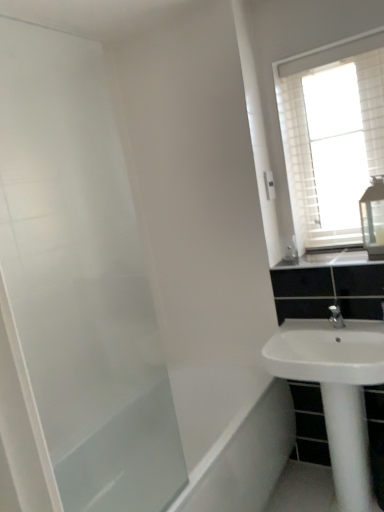
Question: From the image's perspective, is white glossy sink at lower right on top of white textured window at upper right?

Choices:
 (A) yes
 (B) no

Answer: (B)

Question: Considering the relative sizes of white glossy sink at lower right and white textured window at upper right in the image provided, is white glossy sink at lower right taller than white textured window at upper right?

Choices:
 (A) no
 (B) yes

Answer: (A)

Question: Considering the relative positions of white glossy sink at lower right and white textured window at upper right in the image provided, is white glossy sink at lower right to the right of white textured window at upper right from the viewer's perspective?

Choices:
 (A) no
 (B) yes

Answer: (A)

Question: Considering the relative sizes of white glossy sink at lower right and white textured window at upper right in the image provided, is white glossy sink at lower right shorter than white textured window at upper right?

Choices:
 (A) no
 (B) yes

Answer: (B)

Question: Could you tell me if white glossy sink at lower right is facing white textured window at upper right?

Choices:
 (A) no
 (B) yes

Answer: (A)

Question: In terms of width, does white textured window at upper right look wider or thinner when compared to transparent glass screen door at left?

Choices:
 (A) wide
 (B) thin

Answer: (A)

Question: From the image's perspective, relative to transparent glass screen door at left, is white textured window at upper right above or below?

Choices:
 (A) below
 (B) above

Answer: (B)

Question: Choose the correct answer: Is white textured window at upper right inside transparent glass screen door at left or outside it?

Choices:
 (A) outside
 (B) inside

Answer: (A)

Question: Considering the positions of white textured window at upper right and transparent glass screen door at left in the image, is white textured window at upper right bigger or smaller than transparent glass screen door at left?

Choices:
 (A) big
 (B) small

Answer: (B)

Question: Do you think white glossy sink at upper right is within white textured window at upper right, or outside of it?

Choices:
 (A) inside
 (B) outside

Answer: (B)

Question: Is point (345, 262) closer or farther from the camera than point (354, 163)?

Choices:
 (A) closer
 (B) farther

Answer: (A)

Question: Relative to white textured window at upper right, is white glossy sink at upper right in front or behind?

Choices:
 (A) front
 (B) behind

Answer: (A)

Question: In terms of size, does white glossy sink at upper right appear bigger or smaller than white textured window at upper right?

Choices:
 (A) small
 (B) big

Answer: (A)

Question: Visually, is clear glass medicine cabinet at upper right positioned to the left or to the right of transparent glass screen door at left?

Choices:
 (A) left
 (B) right

Answer: (B)

Question: Considering their positions, is clear glass medicine cabinet at upper right located in front of or behind transparent glass screen door at left?

Choices:
 (A) behind
 (B) front

Answer: (A)